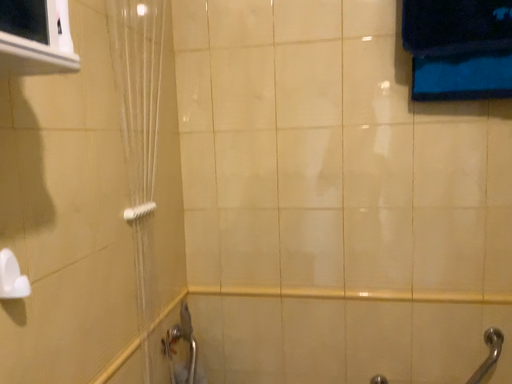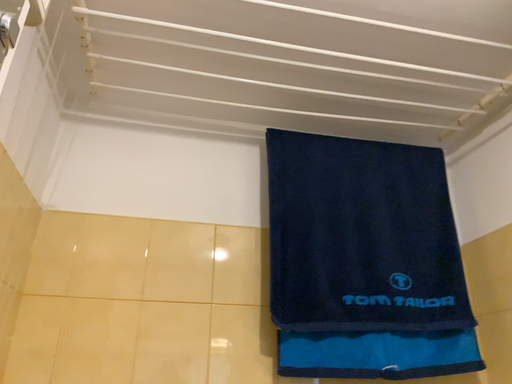
Question: Which way did the camera rotate in the video?

Choices:
 (A) rotated left
 (B) rotated right

Answer: (B)